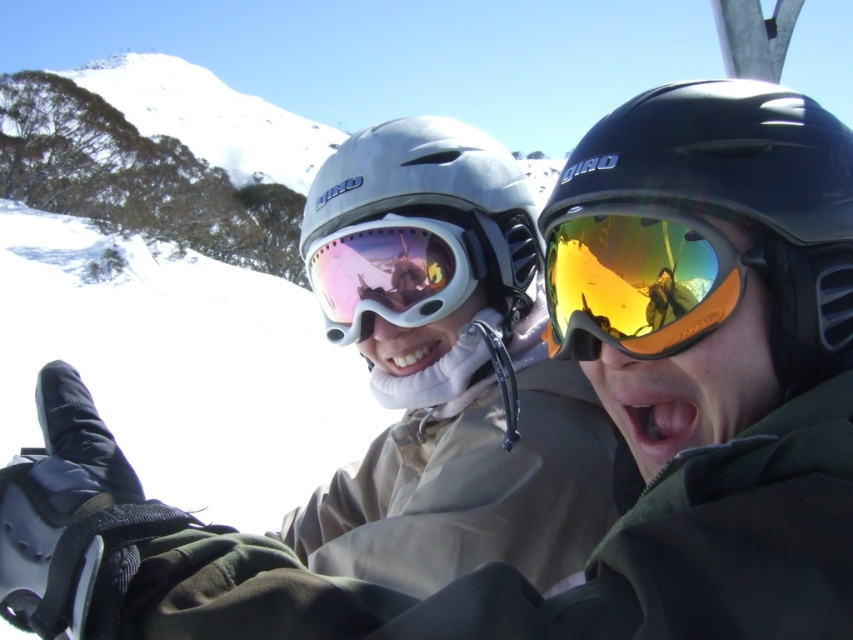
You are a photographer trying to capture the black matte helmet at right in the image. The camera is set to focus on the point at coordinates point [701,259]. Will this point be on the black matte helmet at right?

Yes, the point [701,259] indicates the black matte helmet at right, so the camera will focus on it.

You are a photographer trying to capture a clear shot of the matte gray helmet at center and the pink reflective lens goggles at center. Since you want to focus on the goggles, which object should you adjust your camera to prioritize? Explain why based on their positions.

You should prioritize focusing on the pink reflective lens goggles at center because the matte gray helmet at center is closer to you, making the goggles appear farther away. This means the goggles might be less in focus if the helmet is the main focus.